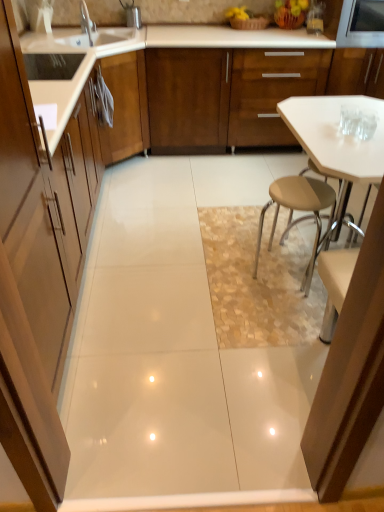
The width and height of the screenshot is (384, 512). Identify the location of vacant space to the right of matte wood cabinet at left, which is counted as the first cabinetry, starting from the bottom. (131, 371).